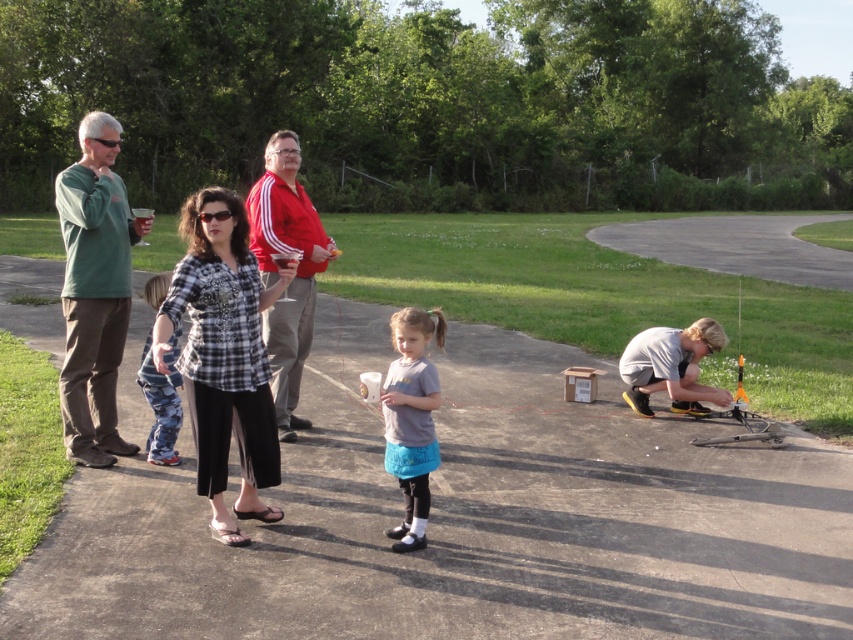
What are the coordinates of `asphalt pavement at center` in the screenshot? It's located at point(462,520).

What do you see at coordinates (462, 520) in the screenshot? The width and height of the screenshot is (853, 640). I see `asphalt pavement at center` at bounding box center [462, 520].

Is point (360, 324) behind point (430, 378)?

Yes, it is.

You are a GUI agent. You are given a task and a screenshot of the screen. Output one action in this format:
    pyautogui.click(x=<x>, y=<y>)
    Task: Click on the asphalt pavement at center
    The image size is (853, 640).
    Given the screenshot: What is the action you would take?
    pyautogui.click(x=462, y=520)

Image resolution: width=853 pixels, height=640 pixels. Describe the element at coordinates (294, 273) in the screenshot. I see `red cotton shirt at center` at that location.

Does red cotton shirt at center appear over gray matte shirt at center?

Yes, red cotton shirt at center is above gray matte shirt at center.

Between point (294, 147) and point (381, 400), which one is positioned in front?

Point (381, 400) is in front.

Where is `red cotton shirt at center`? The width and height of the screenshot is (853, 640). red cotton shirt at center is located at coordinates (294, 273).

Which is below, plaid fabric shirt at center or gray matte shirt at center?

gray matte shirt at center is below.

Can you confirm if plaid fabric shirt at center is taller than gray matte shirt at center?

→ Yes.

Who is more distant from viewer, (222, 472) or (412, 381)?

Point (222, 472)

You are a GUI agent. You are given a task and a screenshot of the screen. Output one action in this format:
    pyautogui.click(x=<x>, y=<y>)
    Task: Click on the plaid fabric shirt at center
    Image resolution: width=853 pixels, height=640 pixels.
    Given the screenshot: What is the action you would take?
    pyautogui.click(x=223, y=355)